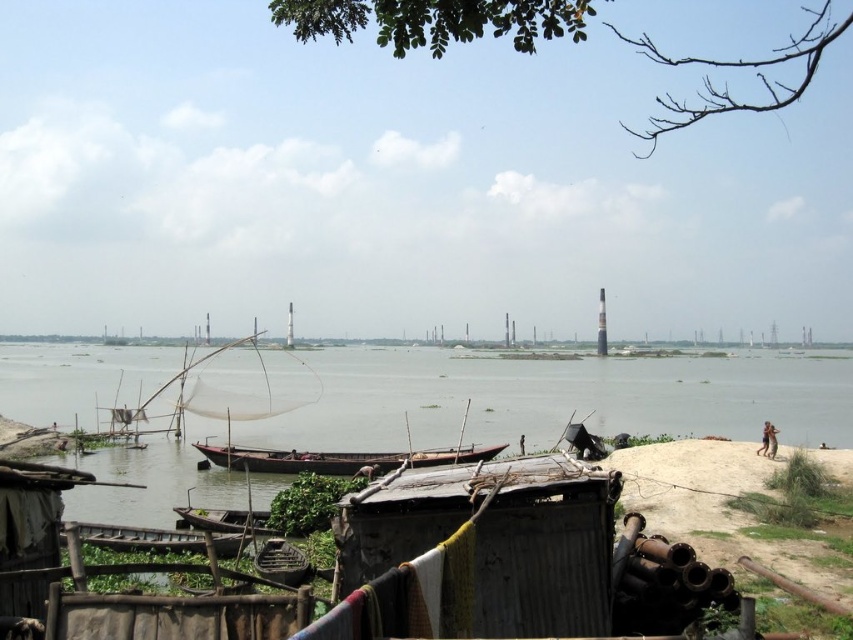
Question: Which object appears farthest from the camera in this image?

Choices:
 (A) wooden boat at lower center
 (B) wooden boat at center

Answer: (B)

Question: Is wooden boat at center positioned at the back of wooden boat at lower left?

Choices:
 (A) no
 (B) yes

Answer: (B)

Question: Does wooden boat at center have a smaller size compared to wooden boat at lower left?

Choices:
 (A) no
 (B) yes

Answer: (A)

Question: Which of the following is the closest to the observer?

Choices:
 (A) wooden boat at lower center
 (B) wooden boat at lower left

Answer: (A)

Question: Which object appears farthest from the camera in this image?

Choices:
 (A) wooden boat at center
 (B) wooden boat at lower center

Answer: (A)

Question: Can you confirm if wooden boat at lower left is bigger than wooden boat at lower center?

Choices:
 (A) no
 (B) yes

Answer: (A)